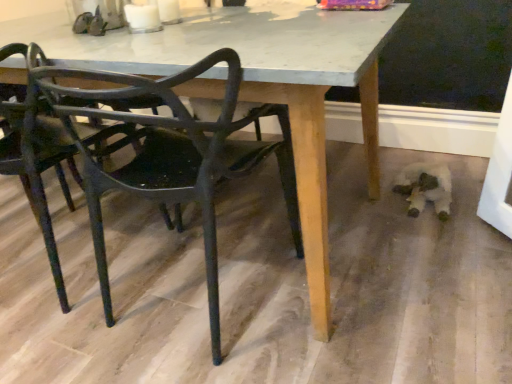
Question: Looking at the image, does matte black chair at lower left, marked as the 2th chair in a left-to-right arrangement, seem bigger or smaller compared to metallic black chair at left, which is counted as the second chair, starting from the right?

Choices:
 (A) big
 (B) small

Answer: (B)

Question: Considering the positions of matte black chair at lower left, marked as the 2th chair in a left-to-right arrangement, and metallic black chair at left, marked as the 1th chair in a left-to-right arrangement, in the image, is matte black chair at lower left, marked as the 2th chair in a left-to-right arrangement, wider or thinner than metallic black chair at left, marked as the 1th chair in a left-to-right arrangement,?

Choices:
 (A) wide
 (B) thin

Answer: (B)

Question: From the image's perspective, is matte black chair at lower left, marked as the 2th chair in a left-to-right arrangement, above or below metallic black chair at left, marked as the 1th chair in a left-to-right arrangement?

Choices:
 (A) above
 (B) below

Answer: (B)

Question: Is metallic black chair at left, marked as the 1th chair in a left-to-right arrangement, situated inside matte black chair at lower left, which is the first chair from right to left, or outside?

Choices:
 (A) outside
 (B) inside

Answer: (A)

Question: Is metallic black chair at left, marked as the 1th chair in a left-to-right arrangement, in front of or behind matte black chair at lower left, which is the first chair from right to left, in the image?

Choices:
 (A) behind
 (B) front

Answer: (A)

Question: From a real-world perspective, relative to matte black chair at lower left, which is the first chair from right to left, is metallic black chair at left, which is counted as the second chair, starting from the right, vertically above or below?

Choices:
 (A) below
 (B) above

Answer: (B)

Question: Visually, is metallic black chair at left, marked as the 1th chair in a left-to-right arrangement, positioned to the left or to the right of matte black chair at lower left, which is the first chair from right to left?

Choices:
 (A) right
 (B) left

Answer: (B)